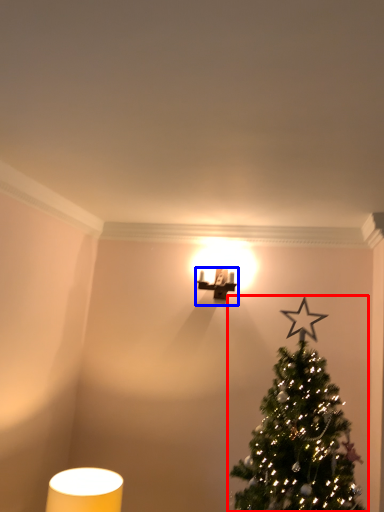
Question: Which object appears farthest to the camera in this image, christmas tree (highlighted by a red box) or table lamp (highlighted by a blue box)?

Choices:
 (A) christmas tree
 (B) table lamp

Answer: (B)